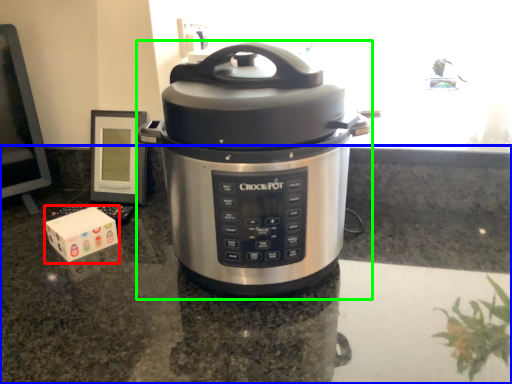
Question: Considering the real-world distances, which object is farthest from block (highlighted by a red box)? counter top (highlighted by a blue box) or slow cooker (highlighted by a green box)?

Choices:
 (A) counter top
 (B) slow cooker

Answer: (B)